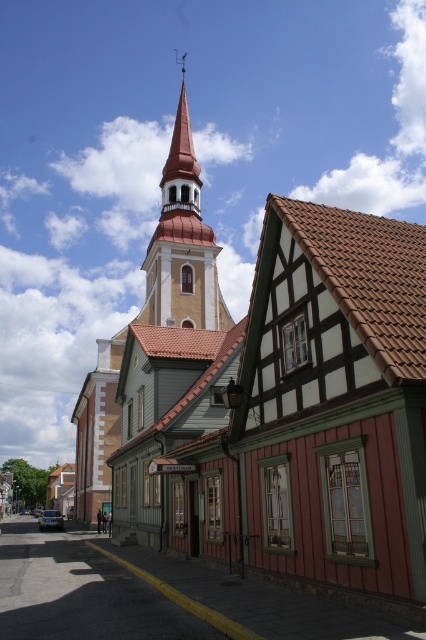
Question: Does matte yellow church steeple at upper left have a greater width compared to smooth orange spire at center?

Choices:
 (A) yes
 (B) no

Answer: (A)

Question: Does matte yellow church steeple at upper left have a larger size compared to smooth orange steeple at center?

Choices:
 (A) yes
 (B) no

Answer: (A)

Question: Estimate the real-world distances between objects in this image. Which object is farther from the matte yellow church steeple at upper left?

Choices:
 (A) smooth orange steeple at center
 (B) smooth orange spire at center

Answer: (B)

Question: Which is nearer to the smooth orange spire at center?

Choices:
 (A) smooth orange steeple at center
 (B) matte yellow church steeple at upper left

Answer: (A)

Question: Which object appears closest to the camera in this image?

Choices:
 (A) smooth orange spire at center
 (B) smooth orange steeple at center

Answer: (B)

Question: Does matte yellow church steeple at upper left have a smaller size compared to smooth orange spire at center?

Choices:
 (A) yes
 (B) no

Answer: (B)